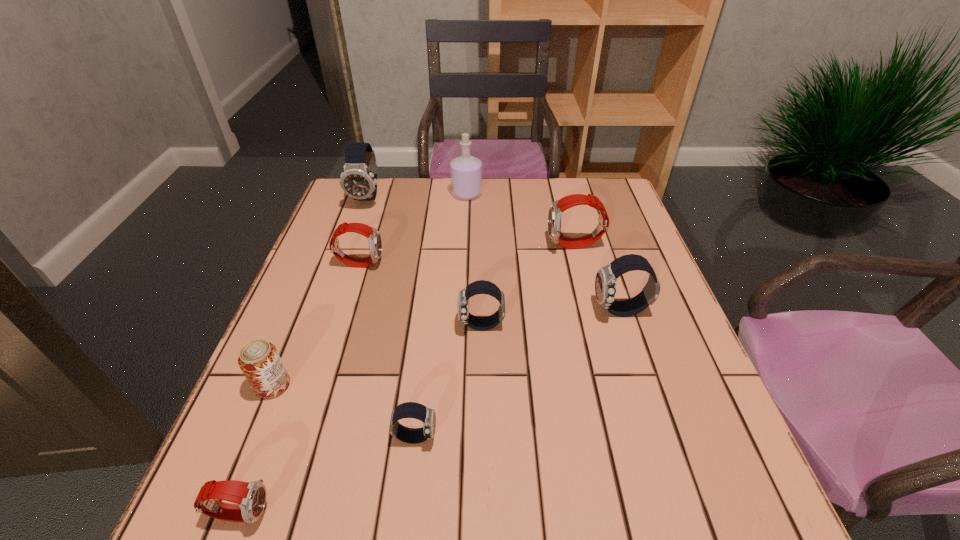
I want to click on purple perfume, so click(466, 171).

I want to click on the tallest watch, so click(x=358, y=180).

You are a GUI agent. You are given a task and a screenshot of the screen. Output one action in this format:
    pyautogui.click(x=<x>, y=<y>)
    Task: Click on the leftmost dark watch
    
    Given the screenshot: What is the action you would take?
    pyautogui.click(x=358, y=180)

Where is `the rightmost dark watch`? Image resolution: width=960 pixels, height=540 pixels. the rightmost dark watch is located at coordinates (605, 282).

Find the location of a particular element. The height and width of the screenshot is (540, 960). the rightmost red watch is located at coordinates (556, 210).

Locate an element on the screen. the second smallest dark watch is located at coordinates (478, 287).

The height and width of the screenshot is (540, 960). Identify the location of the third watch from right to left. (478, 287).

In order to click on the second smallest red watch in this screenshot , I will do `click(375, 242)`.

At what (x,y) coordinates should I click in order to perform the action: click on the seventh farthest object. Please return your answer as a coordinate pair (x, y). The image size is (960, 540). Looking at the image, I should click on (259, 360).

Image resolution: width=960 pixels, height=540 pixels. In order to click on the third dark watch from right to left in this screenshot , I will do `click(414, 410)`.